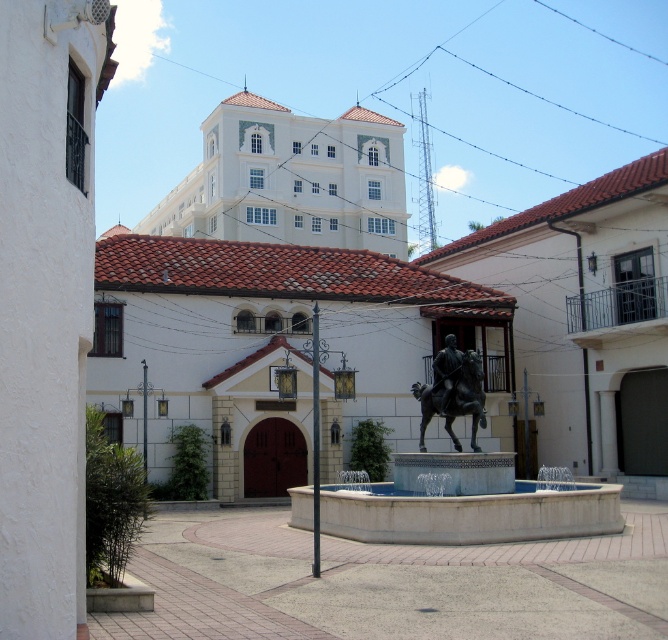
You are an architect designing a new plaza and want to place a bench between the white marble fountain at center and the polished bronze statue at center. If the bench requires 1.2 meters of space, can it fit between them?

The white marble fountain at center is larger in size than the polished bronze statue at center, but the exact distance between them isn not provided. Without knowing the spacing between the two objects, it is impossible to determine if the bench will fit.

You are standing in the plaza and want to take a photo of the fountain. You notice two points marked on the ground at coordinates point (x=458, y=445) and point (x=440, y=371). Which point should you stand closer to ensure the fountain is in focus without moving the camera?

A: You should stand closer to point (x=458, y=445) because it is closer to the camera than point (x=440, y=371), ensuring the fountain remains in focus.

You are standing at the entrance of the plaza and want to locate the white marble fountain at center. According to the coordinates provided, where should you look to find it?

The white marble fountain at center is located at coordinates point [462,492], so you should look towards the lower right side of the image to find it.